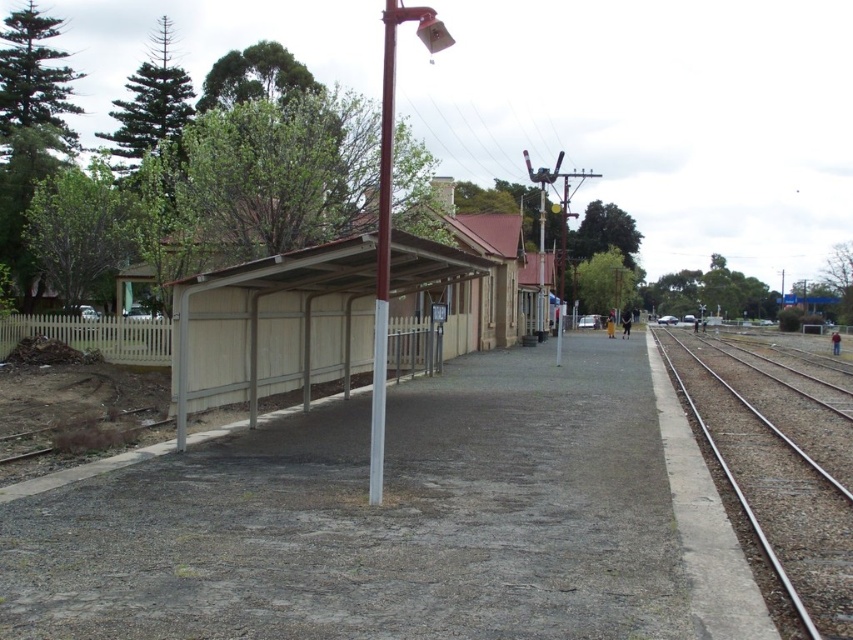
Does metal/smooth train track at right have a greater height compared to white glossy pole at center?

No, metal/smooth train track at right is not taller than white glossy pole at center.

Is point (805, 496) closer to viewer compared to point (383, 323)?

No, (805, 496) is behind (383, 323).

Does point (801, 406) come in front of point (373, 380)?

No, it is behind (373, 380).

Identify the location of metal/smooth train track at right. The image size is (853, 640). (775, 477).

Which is in front, point (384, 61) or point (540, 227)?

Point (384, 61)

Does white glossy pole at center have a smaller size compared to metallic pole at center?

Yes, white glossy pole at center is smaller than metallic pole at center.

Is point (381, 294) closer to camera compared to point (543, 218)?

Yes, it is in front of point (543, 218).

Locate an element on the screen. The image size is (853, 640). white glossy pole at center is located at coordinates (381, 253).

Who is shorter, metal/smooth train track at right or metallic pole at center?

metal/smooth train track at right is shorter.

Does metal/smooth train track at right have a greater height compared to metallic pole at center?

No, metal/smooth train track at right is not taller than metallic pole at center.

What are the coordinates of `metal/smooth train track at right` in the screenshot? It's located at (775, 477).